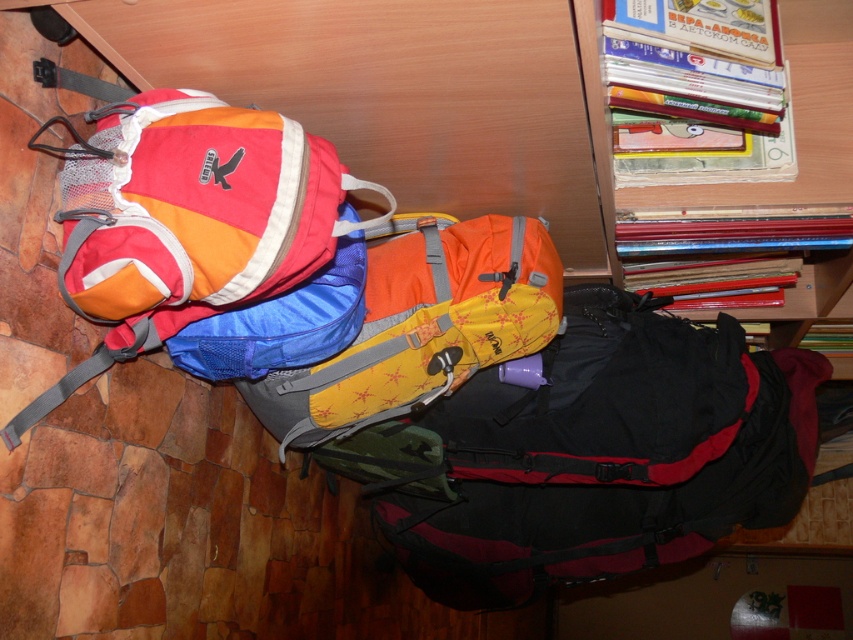
Question: Can you confirm if matte nylon backpack at left is positioned to the left of hardcover book at upper right?

Choices:
 (A) no
 (B) yes

Answer: (B)

Question: Is yellow fabric backpack at center closer to the viewer compared to hardcover book at upper right?

Choices:
 (A) yes
 (B) no

Answer: (B)

Question: Which object appears farthest from the camera in this image?

Choices:
 (A) matte nylon backpack at left
 (B) matte black backpack at center
 (C) hardcover book at upper right
 (D) yellow fabric backpack at center

Answer: (B)

Question: Does matte nylon backpack at left have a smaller size compared to wooden bookshelf at upper right?

Choices:
 (A) no
 (B) yes

Answer: (B)

Question: Based on their relative distances, which object is farther from the wooden bookshelf at upper right?

Choices:
 (A) matte black backpack at center
 (B) hardcover book at upper right
 (C) yellow fabric backpack at center
 (D) matte nylon backpack at left

Answer: (A)

Question: Which of the following is the farthest from the observer?

Choices:
 (A) (344, 384)
 (B) (515, 499)
 (C) (802, 115)
 (D) (682, 80)

Answer: (B)